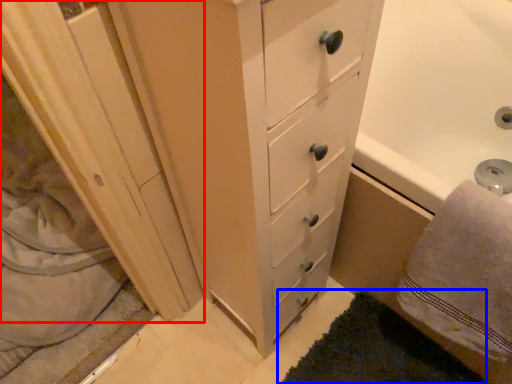
Question: Which object appears farthest to the camera in this image, screen door (highlighted by a red box) or bath mat (highlighted by a blue box)?

Choices:
 (A) screen door
 (B) bath mat

Answer: (A)